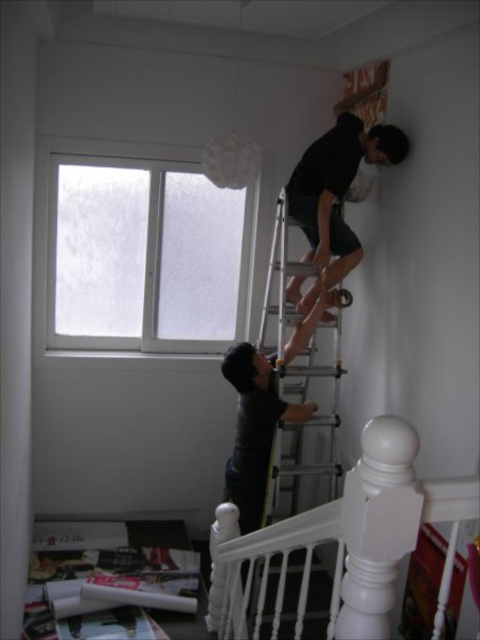
Is transparent glass window at upper left taller than white glossy handrail at upper center?

In fact, transparent glass window at upper left may be shorter than white glossy handrail at upper center.

Does transparent glass window at upper left have a smaller size compared to white glossy handrail at upper center?

Correct, transparent glass window at upper left occupies less space than white glossy handrail at upper center.

Does point (118, 211) come behind point (393, 544)?

That is True.

Locate an element on the screen. The width and height of the screenshot is (480, 640). transparent glass window at upper left is located at coordinates (146, 256).

Is white glossy handrail at upper center thinner than silver metallic ladder at upper center?

In fact, white glossy handrail at upper center might be wider than silver metallic ladder at upper center.

Is white glossy handrail at upper center further to camera compared to silver metallic ladder at upper center?

That is False.

The width and height of the screenshot is (480, 640). What do you see at coordinates (345, 540) in the screenshot? I see `white glossy handrail at upper center` at bounding box center [345, 540].

At what (x,y) coordinates should I click in order to perform the action: click on white glossy handrail at upper center. Please return your answer as a coordinate pair (x, y). The height and width of the screenshot is (640, 480). Looking at the image, I should click on (345, 540).

Is point (284, 248) farther from camera compared to point (311, 292)?

That is False.

Is silver metallic ladder at upper center closer to the viewer compared to black matte shirt at upper right?

That is False.

Which is in front, point (294, 492) or point (312, 284)?

Point (312, 284)

The height and width of the screenshot is (640, 480). Find the location of `silver metallic ladder at upper center`. silver metallic ladder at upper center is located at coordinates (296, 381).